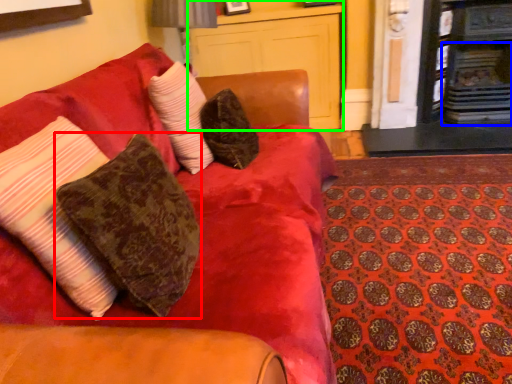
Question: Based on their relative distances, which object is farther from pillow (highlighted by a red box)? Choose from fireplace (highlighted by a blue box) and dresser (highlighted by a green box).

Choices:
 (A) fireplace
 (B) dresser

Answer: (A)